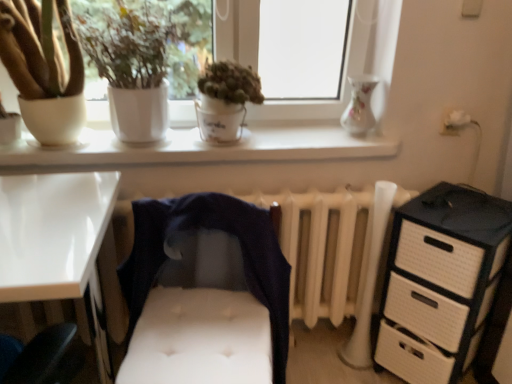
What is the approximate height of matte white pot at left, positioned as the 1th houseplant in left-to-right order?

The height of matte white pot at left, positioned as the 1th houseplant in left-to-right order, is 18.38 inches.

What do you see at coordinates (225, 100) in the screenshot?
I see `green matte plant at center, placed as the 1th houseplant when sorted from right to left` at bounding box center [225, 100].

In order to click on porcelain floral vase at upper right in this screenshot , I will do `click(360, 105)`.

What is the approximate height of white woven chest of drawers at right?

The height of white woven chest of drawers at right is 28.16 inches.

At what (x,y) coordinates should I click in order to perform the action: click on matte white pot at left, positioned as the 1th houseplant in left-to-right order. Please return your answer as a coordinate pair (x, y). Looking at the image, I should click on (42, 69).

From the image's perspective, is white matte pot at upper left, which is the second houseplant from left to right, located above or below porcelain floral vase at upper right?

From the image's perspective, white matte pot at upper left, which is the second houseplant from left to right, appears above porcelain floral vase at upper right.

Is white matte pot at upper left, which is the second houseplant from left to right, in contact with porcelain floral vase at upper right?

No, white matte pot at upper left, which is the second houseplant from left to right, is not beside porcelain floral vase at upper right.

Could you tell me if white matte pot at upper left, which is the second houseplant from left to right, is facing porcelain floral vase at upper right?

No, white matte pot at upper left, which is the second houseplant from left to right, is not facing towards porcelain floral vase at upper right.

Is porcelain floral vase at upper right a part of white matte pot at upper left, which is the second houseplant from left to right?

No, white matte pot at upper left, which is the second houseplant from left to right, does not contain porcelain floral vase at upper right.

Based on the photo, is green matte plant at center, placed as the 1th houseplant when sorted from right to left, facing away from white glossy window at upper center?

Yes, green matte plant at center, placed as the 1th houseplant when sorted from right to left, is positioned with its back facing white glossy window at upper center.

Considering the sizes of objects green matte plant at center, placed as the 1th houseplant when sorted from right to left, and white glossy window at upper center in the image provided, who is bigger, green matte plant at center, placed as the 1th houseplant when sorted from right to left, or white glossy window at upper center?

white glossy window at upper center.

Is green matte plant at center, placed as the 1th houseplant when sorted from right to left, at the right side of white glossy window at upper center?

Yes.

How different are the orientations of green matte plant at center, placed as the 1th houseplant when sorted from right to left, and white glossy window at upper center in degrees?

2.87 degrees separate the facing orientations of green matte plant at center, placed as the 1th houseplant when sorted from right to left, and white glossy window at upper center.

Can green matte plant at center, placed as the 1th houseplant when sorted from right to left, be found inside white glossy window sill at upper center?

No, white glossy window sill at upper center does not contain green matte plant at center, placed as the 1th houseplant when sorted from right to left.

Is point (20, 145) in front of point (225, 69)?

No, it is not.

Consider the image. Considering the sizes of white glossy window sill at upper center and green matte plant at center, acting as the third houseplant starting from the left, in the image, is white glossy window sill at upper center wider or thinner than green matte plant at center, acting as the third houseplant starting from the left,?

Clearly, white glossy window sill at upper center has more width compared to green matte plant at center, acting as the third houseplant starting from the left.

From the picture: Is white glossy window at upper center located outside white glossy window sill at upper center?

That's correct, white glossy window at upper center is outside of white glossy window sill at upper center.

Are white glossy window at upper center and white glossy window sill at upper center beside each other?

Yes, white glossy window at upper center is next to white glossy window sill at upper center.

Which of these two, white glossy window at upper center or white glossy window sill at upper center, is bigger?

Bigger between the two is white glossy window at upper center.

From the image's perspective, is white glossy window at upper center above or below white glossy window sill at upper center?

Based on their image positions, white glossy window at upper center is located above white glossy window sill at upper center.

The width and height of the screenshot is (512, 384). In order to click on window located behind the white glossy desk at lower left in this screenshot , I will do `click(206, 148)`.

Between white glossy desk at lower left and white glossy window at upper center, which one has smaller width?

Thinner between the two is white glossy window at upper center.

Based on the photo, is white glossy desk at lower left not near white glossy window at upper center?

That's not correct — white glossy desk at lower left is a little close to white glossy window at upper center.

Considering the relative positions of white glossy desk at lower left and white glossy window at upper center in the image provided, is white glossy desk at lower left to the right of white glossy window at upper center from the viewer's perspective?

No.

Can you confirm if white woven chest of drawers at right is thinner than matte white pot at left, positioned as the 1th houseplant in left-to-right order?

No.

Is matte white pot at left, positioned as the 1th houseplant in left-to-right order, a part of white woven chest of drawers at right?

No, matte white pot at left, positioned as the 1th houseplant in left-to-right order, is not surrounded by white woven chest of drawers at right.

Is point (481, 208) positioned behind point (26, 48)?

Yes, it is.

Can dark blue fabric at center be found inside white glossy desk at lower left?

That's incorrect, dark blue fabric at center is not inside white glossy desk at lower left.

Is white glossy desk at lower left oriented towards dark blue fabric at center?

No, white glossy desk at lower left is not aimed at dark blue fabric at center.

Can you confirm if white glossy desk at lower left is bigger than dark blue fabric at center?

Yes, white glossy desk at lower left is bigger than dark blue fabric at center.

You are a GUI agent. You are given a task and a screenshot of the screen. Output one action in this format:
    pyautogui.click(x=<x>, y=<y>)
    Task: Click on the houseplant that is the 2nd one when counting upward from the porcelain floral vase at upper right (from the image's perspective)
    
    Given the screenshot: What is the action you would take?
    pyautogui.click(x=146, y=58)

This screenshot has width=512, height=384. I want to click on houseplant on the right of white glossy window at upper center, so click(225, 100).

When comparing their distances from white glossy window sill at upper center, does white glossy window at upper center or white glossy desk at lower left seem further?

Based on the image, white glossy desk at lower left appears to be further to white glossy window sill at upper center.

Considering their positions, is dark blue fabric at center positioned further to green matte plant at center, acting as the third houseplant starting from the left, than porcelain floral vase at upper right?

porcelain floral vase at upper right is positioned further to the anchor green matte plant at center, acting as the third houseplant starting from the left.

When comparing their distances from porcelain floral vase at upper right, does white woven chest of drawers at right or dark blue fabric at center seem closer?

Based on the image, white woven chest of drawers at right appears to be nearer to porcelain floral vase at upper right.

Based on their spatial positions, is white matte pot at upper left, which is the second houseplant from left to right, or porcelain floral vase at upper right further from white glossy window at upper center?

Among the two, porcelain floral vase at upper right is located further to white glossy window at upper center.

Which object lies further to the anchor point white glossy window at upper center, green matte plant at center, acting as the third houseplant starting from the left, or white glossy window sill at upper center?

green matte plant at center, acting as the third houseplant starting from the left.

Which object lies further to the anchor point white woven chest of drawers at right, white glossy window at upper center or matte white pot at left, positioned as the 1th houseplant in left-to-right order?

Among the two, matte white pot at left, positioned as the 1th houseplant in left-to-right order, is located further to white woven chest of drawers at right.

From the image, which object appears to be nearer to white matte pot at upper left, positioned as the 2th houseplant in right-to-left order, porcelain floral vase at upper right or white glossy window sill at upper center?

Among the two, white glossy window sill at upper center is located nearer to white matte pot at upper left, positioned as the 2th houseplant in right-to-left order.

From the picture: When comparing their distances from white glossy window at upper center, does white woven chest of drawers at right or green matte plant at center, acting as the third houseplant starting from the left, seem further?

white woven chest of drawers at right lies further to white glossy window at upper center than the other object.

Where is `window located between white glossy desk at lower left and white woven chest of drawers at right in the left-right direction`? The height and width of the screenshot is (384, 512). window located between white glossy desk at lower left and white woven chest of drawers at right in the left-right direction is located at coordinates (206, 148).

The height and width of the screenshot is (384, 512). I want to click on window sill between white glossy window at upper center and white glossy desk at lower left in the vertical direction, so click(202, 148).

This screenshot has height=384, width=512. I want to click on houseplant situated between white glossy window sill at upper center and white woven chest of drawers at right from left to right, so click(225, 100).

Locate an element on the screen. window between matte white pot at left, the 3th houseplant viewed from the right, and white woven chest of drawers at right, in the horizontal direction is located at coordinates (206, 148).